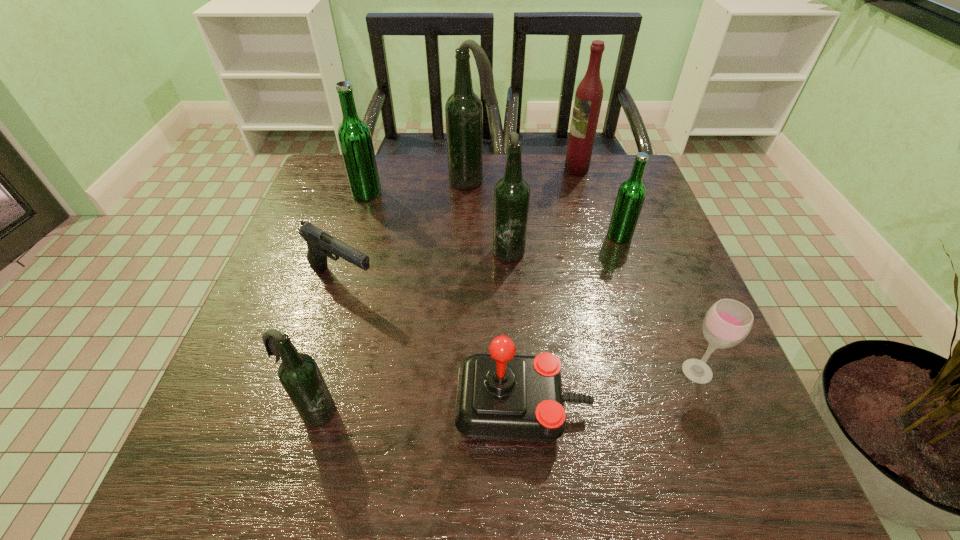
At what (x,y) coordinates should I click in order to perform the action: click on wineglass at the right edge. Please return your answer as a coordinate pair (x, y). The height and width of the screenshot is (540, 960). Looking at the image, I should click on (727, 322).

This screenshot has height=540, width=960. I want to click on object present at the far left corner, so click(354, 136).

Where is `object that is at the far right corner`? object that is at the far right corner is located at coordinates (589, 94).

In the image, there is a desktop. Where is `vacant space at the far edge`? Image resolution: width=960 pixels, height=540 pixels. vacant space at the far edge is located at coordinates (563, 183).

The height and width of the screenshot is (540, 960). I want to click on free space at the near edge of the desktop, so click(x=620, y=468).

This screenshot has width=960, height=540. I want to click on free point at the left edge, so click(300, 303).

Identify the location of vacant space at the right edge of the desktop. The width and height of the screenshot is (960, 540). (687, 328).

The image size is (960, 540). What are the coordinates of `free space between the shortest object and the second farthest dark beer bottle` in the screenshot? It's located at (425, 265).

The image size is (960, 540). I want to click on vacant space that's between the rightmost beer bottle and the black gun, so click(x=481, y=259).

Locate an element on the screen. Image resolution: width=960 pixels, height=540 pixels. unoccupied area between the wineglass and the right green beer bottle is located at coordinates (659, 303).